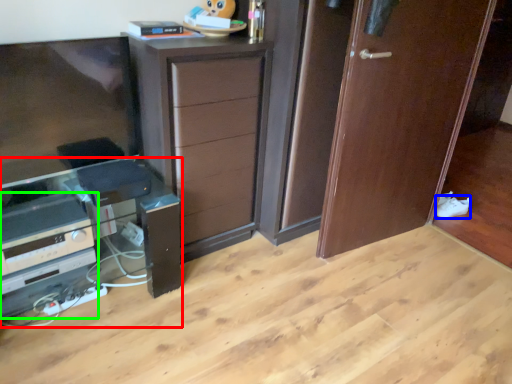
Question: Estimate the real-world distances between objects in this image. Which object is farther from computer desk (highlighted by a red box), shoe (highlighted by a blue box) or appliance (highlighted by a green box)?

Choices:
 (A) shoe
 (B) appliance

Answer: (A)